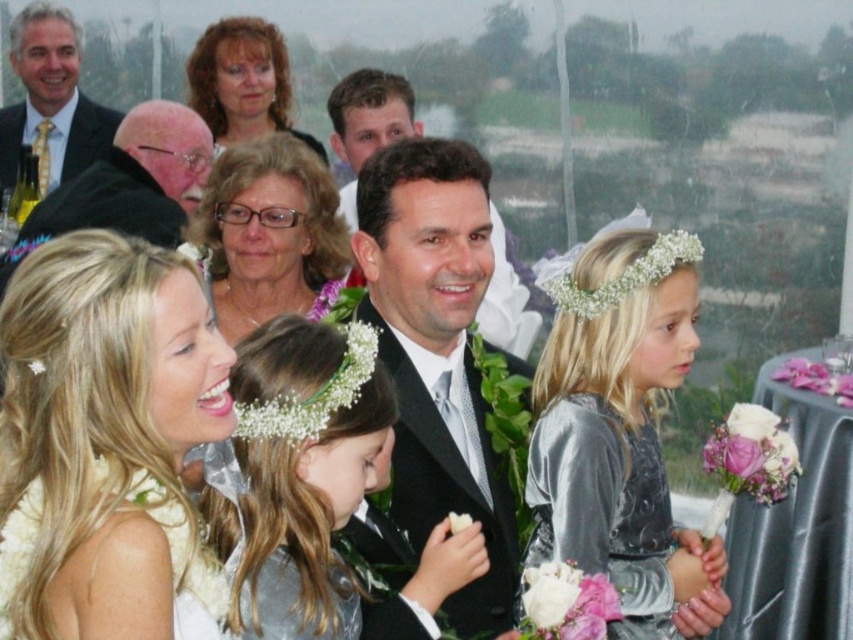
Question: Is silver metallic dress at center bigger than satin silver dress at lower right?

Choices:
 (A) no
 (B) yes

Answer: (B)

Question: Considering the real-world distances, which object is closest to the silver metallic dress at center?

Choices:
 (A) matte silver hair at center
 (B) matte black suit at upper left

Answer: (A)

Question: Can you confirm if shiny black suit at center is positioned above matte silver hair at center?

Choices:
 (A) no
 (B) yes

Answer: (A)

Question: Can you confirm if matte black suit at upper center is positioned above white satin dress at lower left?

Choices:
 (A) no
 (B) yes

Answer: (B)

Question: Which point appears closest to the camera in this image?

Choices:
 (A) (618, 442)
 (B) (631, 557)
 (C) (498, 333)

Answer: (B)

Question: Which object is farther from the camera taking this photo?

Choices:
 (A) matte black suit at upper left
 (B) silver metallic dress at center
 (C) white satin dress at center
 (D) blonde hair at upper center

Answer: (D)